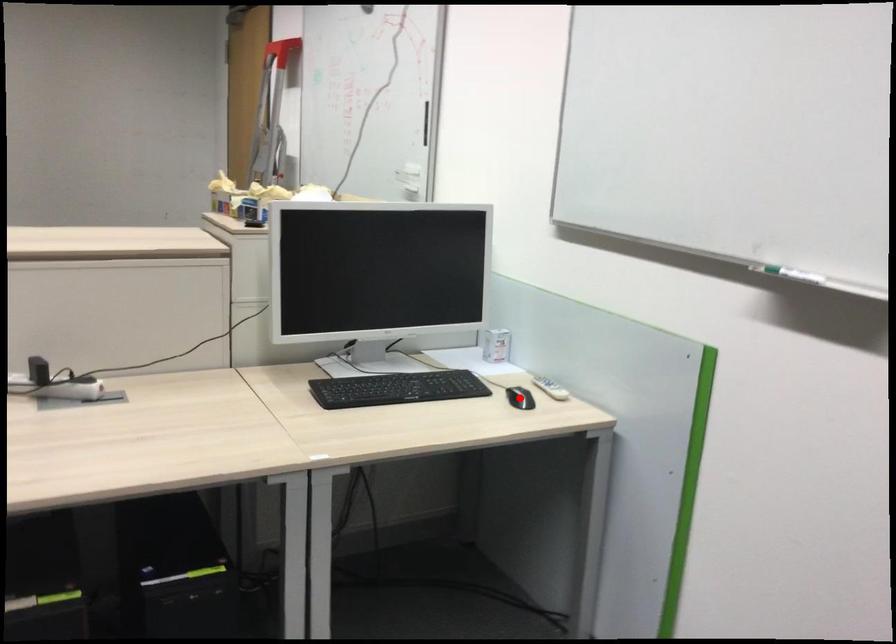
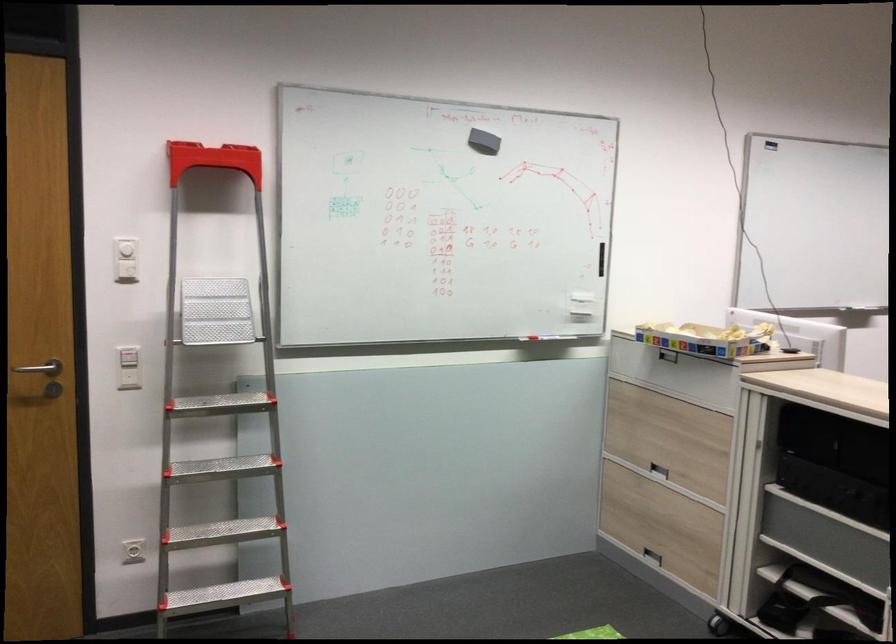
Question: I am providing you with two images of the same scene from different viewpoints. A red point is marked on the first image. At the location where the point appears in image 1, is it still visible in image 2?

Choices:
 (A) Yes
 (B) No

Answer: (B)